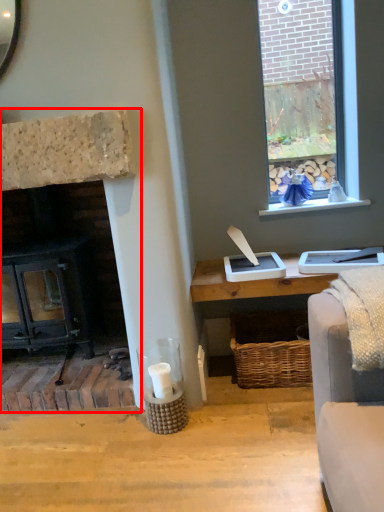
Question: Observing the image, what is the correct spatial positioning of fireplace (annotated by the red box) in reference to window sill?

Choices:
 (A) left
 (B) right

Answer: (A)